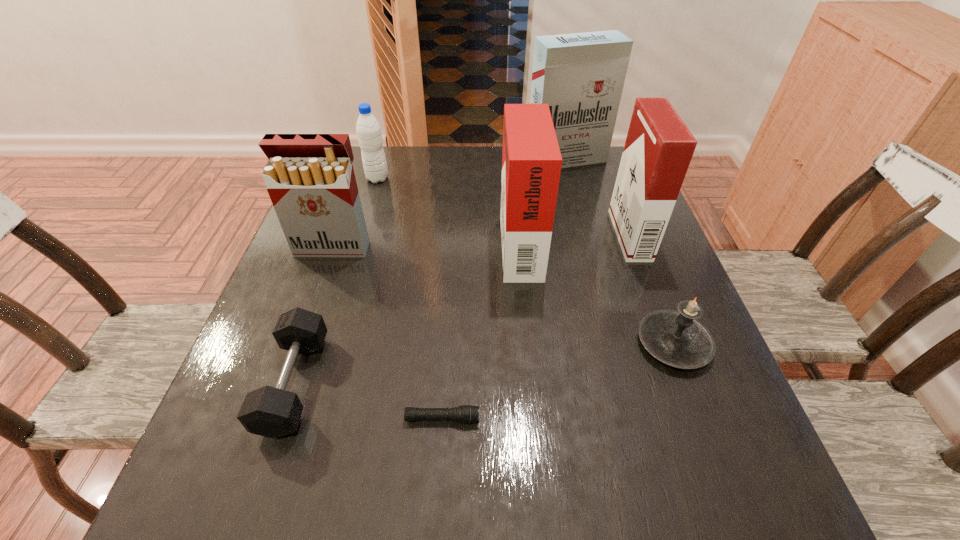
The image size is (960, 540). Find the location of `vacant space located on the back of the water bottle`. vacant space located on the back of the water bottle is located at coordinates [x=383, y=160].

The width and height of the screenshot is (960, 540). I want to click on vacant position located 0.330m on the back of the candle, so click(625, 215).

Locate an element on the screen. This screenshot has width=960, height=540. free space located 0.290m on the back of the seventh tallest object is located at coordinates (344, 238).

The height and width of the screenshot is (540, 960). Find the location of `vacant space situated at the lens end of the flashlight`. vacant space situated at the lens end of the flashlight is located at coordinates (681, 418).

Locate an element on the screen. The image size is (960, 540). cigarette case that is at the far edge is located at coordinates (581, 76).

Find the location of a particular element. water bottle that is at the far edge is located at coordinates (368, 129).

Find the location of a particular element. The image size is (960, 540). cigarette case present at the left edge is located at coordinates (310, 179).

Locate an element on the screen. Image resolution: width=960 pixels, height=540 pixels. water bottle that is at the left edge is located at coordinates (368, 129).

Locate an element on the screen. Image resolution: width=960 pixels, height=540 pixels. dumbbell situated at the left edge is located at coordinates (273, 412).

This screenshot has height=540, width=960. Identify the location of candle located at the right edge. (676, 338).